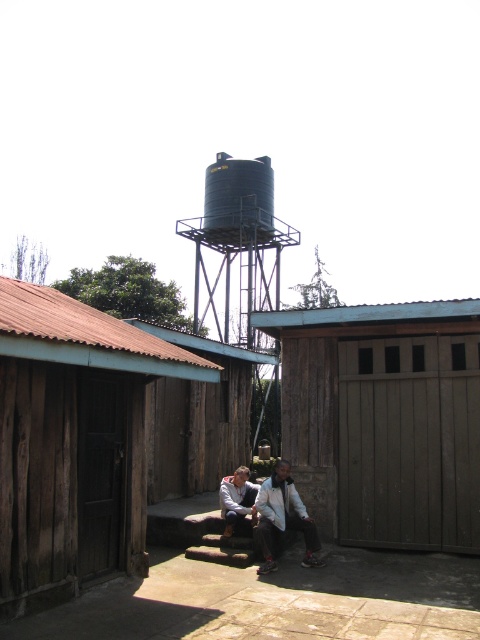
You are a maintenance worker needing to inspect the blue matte water tower at center and the black matte silo at upper center. Which object is located above the other?

The black matte silo at upper center is positioned above the blue matte water tower at center.